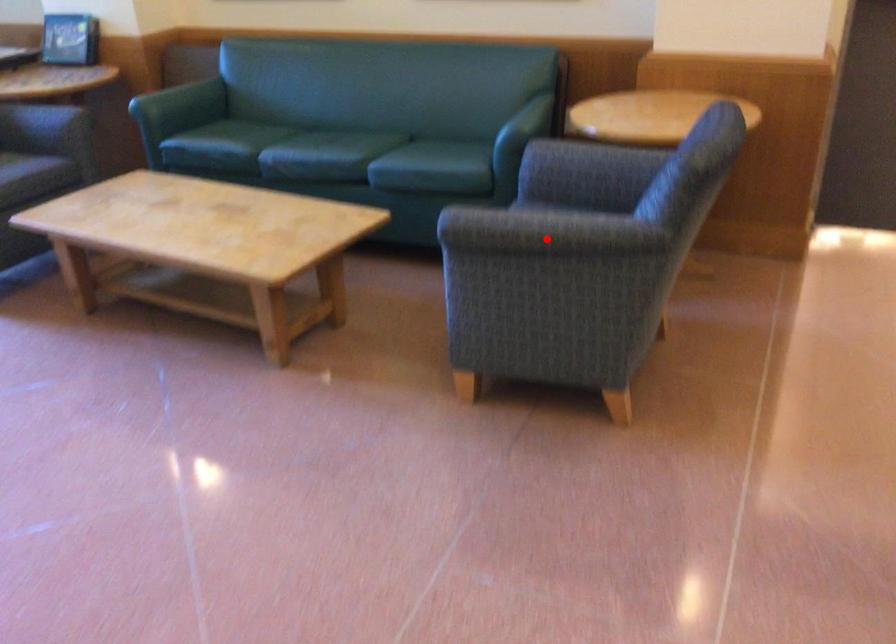
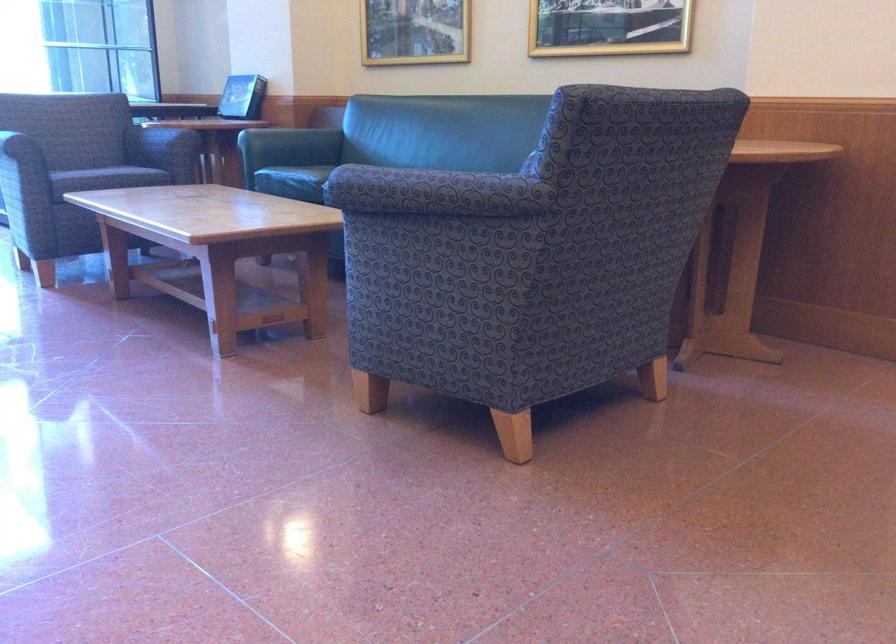
Question: I am providing you with two images of the same scene from different viewpoints. Image1 has a red point marked. In image2, the corresponding 3D location appears at what relative position? Reply with the corresponding letter.

Choices:
 (A) Closer
 (B) Farther

Answer: (A)